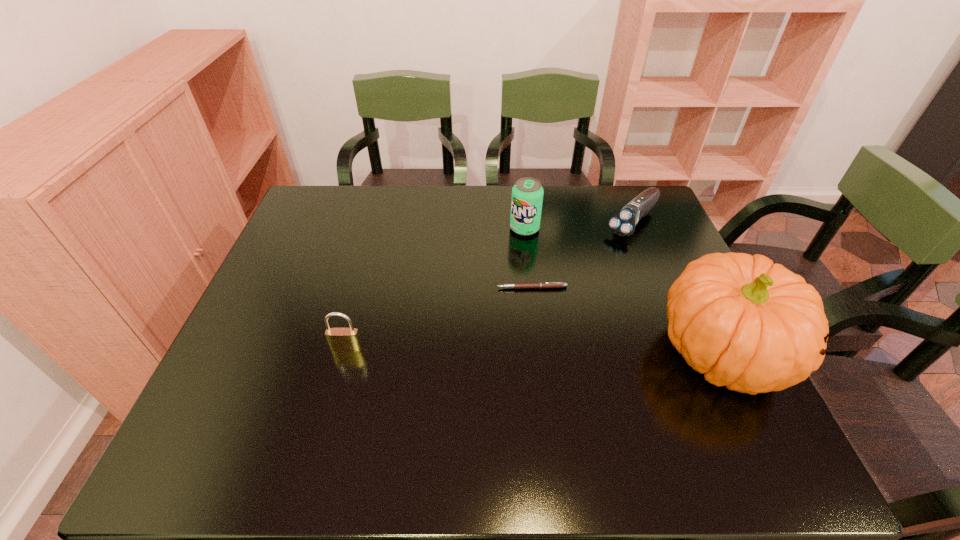
Find the location of a particular element. The image size is (960, 540). pumpkin present at the right edge is located at coordinates (753, 326).

At what (x,y) coordinates should I click in order to perform the action: click on electric shaver at the right edge. Please return your answer as a coordinate pair (x, y). The width and height of the screenshot is (960, 540). Looking at the image, I should click on (623, 223).

Identify the location of object at the far right corner. (623, 223).

Find the location of a particular element. The height and width of the screenshot is (540, 960). object present at the near right corner is located at coordinates (753, 326).

You are a GUI agent. You are given a task and a screenshot of the screen. Output one action in this format:
    pyautogui.click(x=<x>, y=<y>)
    Task: Click on the vacant space at the far edge
    The image size is (960, 540).
    Given the screenshot: What is the action you would take?
    pyautogui.click(x=369, y=185)

In the image, there is a desktop. Identify the location of vacant space at the near edge. The width and height of the screenshot is (960, 540). (566, 393).

The image size is (960, 540). In the image, there is a desktop. In order to click on free space at the left edge in this screenshot , I will do (313, 237).

In the image, there is a desktop. Identify the location of free region at the right edge. The width and height of the screenshot is (960, 540). (660, 347).

Where is `vacant area at the near left corner`? This screenshot has height=540, width=960. vacant area at the near left corner is located at coordinates (238, 397).

Find the location of a particular element. This screenshot has width=960, height=540. vacant area at the far right corner of the desktop is located at coordinates (660, 223).